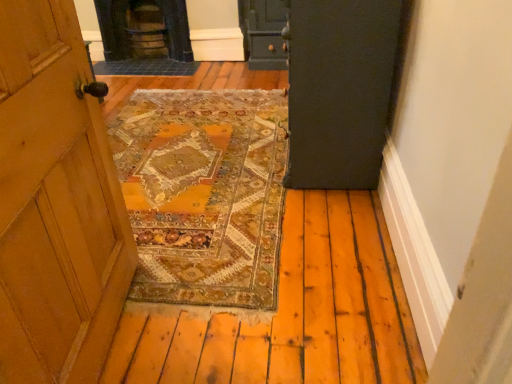
Question: Looking at their shapes, would you say dark brown stone stove at upper center is wider or thinner than matte dark green door at center-right?

Choices:
 (A) thin
 (B) wide

Answer: (A)

Question: From the image's perspective, is dark brown stone stove at upper center above or below matte dark green door at center-right?

Choices:
 (A) above
 (B) below

Answer: (A)

Question: In the image, is dark brown stone stove at upper center on the left side or the right side of matte dark green door at center-right?

Choices:
 (A) left
 (B) right

Answer: (A)

Question: In terms of size, does matte dark green door at center-right appear bigger or smaller than dark brown stone stove at upper center?

Choices:
 (A) big
 (B) small

Answer: (A)

Question: In terms of height, does matte dark green door at center-right look taller or shorter compared to dark brown stone stove at upper center?

Choices:
 (A) short
 (B) tall

Answer: (B)

Question: Is matte dark green door at center-right inside the boundaries of dark brown stone stove at upper center, or outside?

Choices:
 (A) outside
 (B) inside

Answer: (A)

Question: Is point [331, 115] closer or farther from the camera than point [160, 11]?

Choices:
 (A) farther
 (B) closer

Answer: (B)